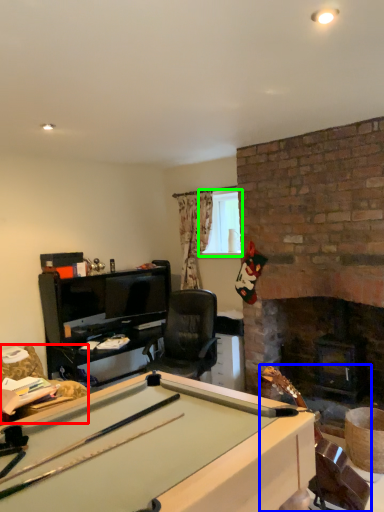
Question: Considering the real-world distances, which object is closest to swivel chair (highlighted by a red box)? equipment (highlighted by a blue box) or window screen (highlighted by a green box).

Choices:
 (A) equipment
 (B) window screen

Answer: (B)